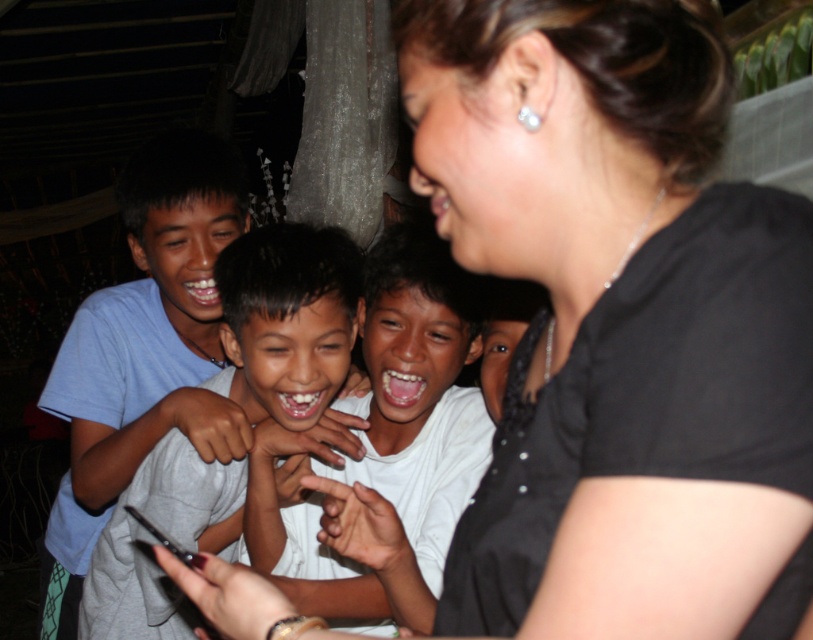
Question: Which point is closer to the camera taking this photo?

Choices:
 (A) (185, 328)
 (B) (137, 534)

Answer: (B)

Question: Which point appears closest to the camera in this image?

Choices:
 (A) (448, 467)
 (B) (274, 262)

Answer: (B)

Question: In this image, where is smooth white shirt at center located relative to gray matte shirt at center?

Choices:
 (A) left
 (B) right

Answer: (B)

Question: Can you confirm if light blue t-shirt at left is positioned to the left of gray matte shirt at center?

Choices:
 (A) no
 (B) yes

Answer: (B)

Question: In this image, where is smooth white shirt at center located relative to gray matte shirt at center?

Choices:
 (A) above
 (B) below

Answer: (A)

Question: Which object appears farthest from the camera in this image?

Choices:
 (A) gray matte shirt at center
 (B) smooth white shirt at center

Answer: (A)